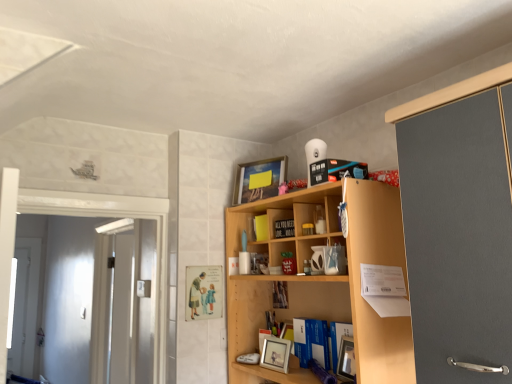
Question: Is yellow matte book at upper center, acting as the second book starting from the back, shorter than matte wooden picture frame at upper center, which ranks as the second picture frame in front-to-back order?

Choices:
 (A) yes
 (B) no

Answer: (A)

Question: Is matte wooden picture frame at upper center, which is the first picture frame from top to bottom, a part of yellow matte book at upper center, which is counted as the second book, starting from the top?

Choices:
 (A) yes
 (B) no

Answer: (B)

Question: Can you confirm if yellow matte book at upper center, marked as the 2th book in a bottom-to-top arrangement, is taller than matte wooden picture frame at upper center, which ranks as the second picture frame in front-to-back order?

Choices:
 (A) yes
 (B) no

Answer: (B)

Question: Considering the relative positions of yellow matte book at upper center, marked as the 2th book in a bottom-to-top arrangement, and matte wooden picture frame at upper center, which ranks as the second picture frame in front-to-back order, in the image provided, is yellow matte book at upper center, marked as the 2th book in a bottom-to-top arrangement, behind matte wooden picture frame at upper center, which ranks as the second picture frame in front-to-back order,?

Choices:
 (A) no
 (B) yes

Answer: (B)

Question: From a real-world perspective, is yellow matte book at upper center, marked as the 2th book in a bottom-to-top arrangement, beneath matte wooden picture frame at upper center, which ranks as the second picture frame in front-to-back order?

Choices:
 (A) no
 (B) yes

Answer: (B)

Question: From a real-world perspective, is yellow matte book at upper center, acting as the second book starting from the back, physically above matte wooden picture frame at upper center, which ranks as the second picture frame in front-to-back order?

Choices:
 (A) yes
 (B) no

Answer: (B)

Question: Can you confirm if wooden shelf at center is smaller than wooden photo frame at center, the third book positioned from the front?

Choices:
 (A) no
 (B) yes

Answer: (A)

Question: From a real-world perspective, is wooden shelf at center on wooden photo frame at center, the third book positioned from the front?

Choices:
 (A) yes
 (B) no

Answer: (B)

Question: Is wooden photo frame at center, the first book in the back-to-front sequence, surrounded by wooden shelf at center?

Choices:
 (A) no
 (B) yes

Answer: (B)

Question: Is wooden shelf at center looking in the opposite direction of wooden photo frame at center, arranged as the first book when ordered from the bottom?

Choices:
 (A) no
 (B) yes

Answer: (B)

Question: From the image's perspective, is wooden shelf at center located above wooden photo frame at center, arranged as the first book when ordered from the bottom?

Choices:
 (A) yes
 (B) no

Answer: (A)

Question: Does wooden shelf at center turn towards wooden photo frame at center, the third book positioned from the front?

Choices:
 (A) no
 (B) yes

Answer: (A)

Question: Considering the relative sizes of white glossy door at left and yellow matte book at upper center, marked as the 2th book in a bottom-to-top arrangement, in the image provided, is white glossy door at left bigger than yellow matte book at upper center, marked as the 2th book in a bottom-to-top arrangement,?

Choices:
 (A) no
 (B) yes

Answer: (B)